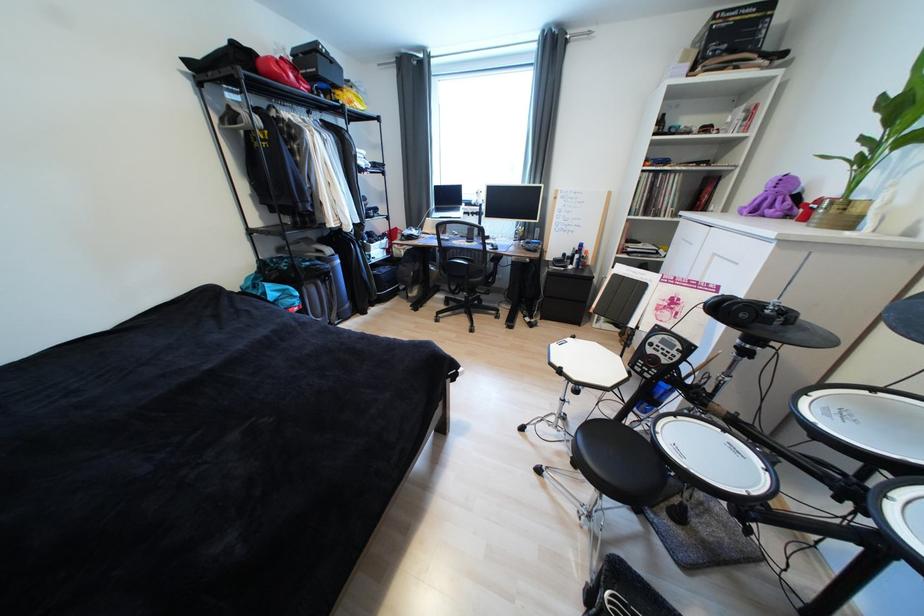
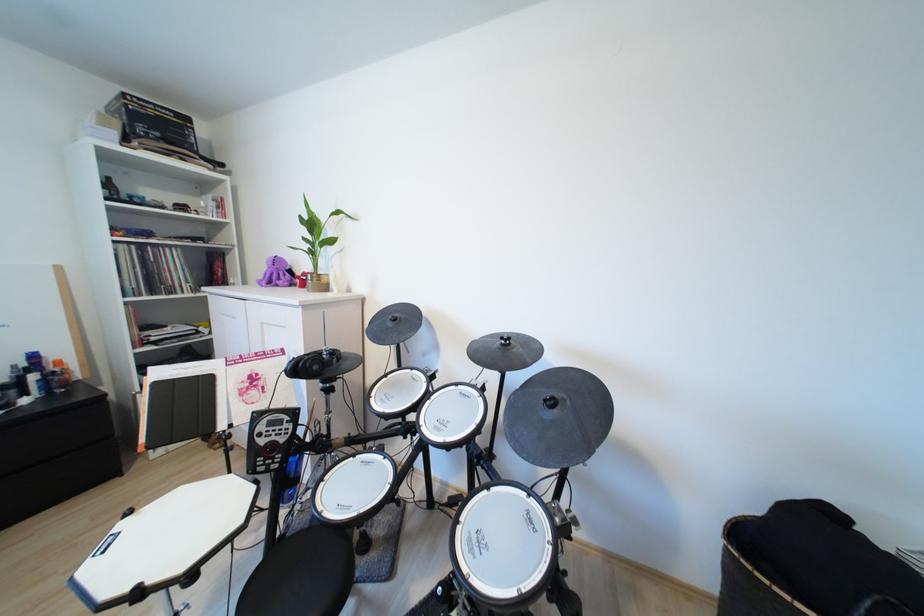
Where in the second image is the point corresponding to point (828, 201) from the first image?

(310, 275)